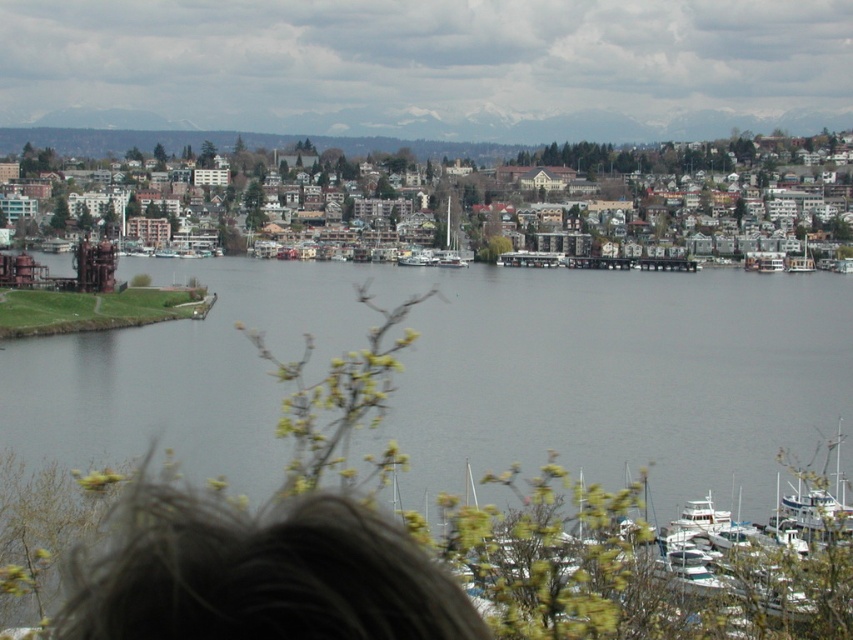
You are standing at the point marked by coordinates point (x=601, y=154) in the image, which is located at the center of the waterfront. Looking towards the direction of the distant mountains, which direction should you walk to reach the brown wooden houses at center?

The point (x=601, y=154) is already at the center of the waterfront where the brown wooden houses at center are located, so you are already there.

You are standing at the point labeled point (107, 376) and want to walk to the point labeled point (450, 224). Which direction should you move to get closer to your destination?

You should move towards the upper left direction because point (450, 224) is located above and to the left of point (107, 376).

You are standing on a balcony overlooking the waterfront scene. You see the brown wooden houses at center and the white glossy boat at lower right. Which object is closer to you?

The brown wooden houses at center are closer to you because they are further to the viewer than the white glossy boat at lower right.